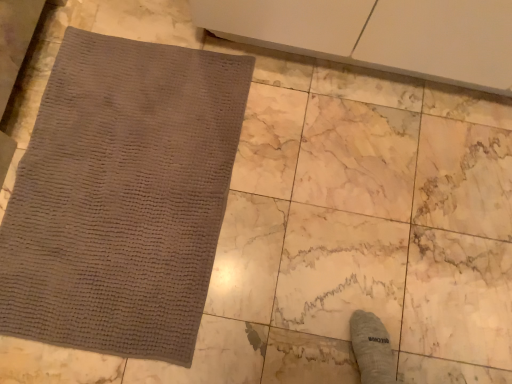
This screenshot has width=512, height=384. I want to click on free spot above gray textured mat at lower left (from a real-world perspective), so click(x=123, y=189).